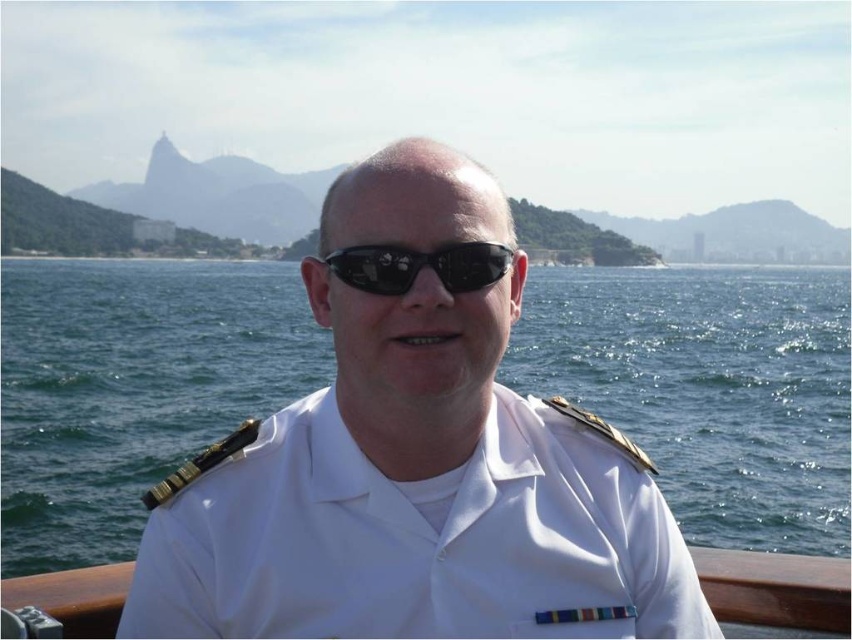
Question: Is white uniform at center bigger than black reflective sunglasses at center?

Choices:
 (A) yes
 (B) no

Answer: (A)

Question: Which of the following is the closest to the observer?

Choices:
 (A) white uniform at center
 (B) black reflective sunglasses at center

Answer: (A)

Question: Is white uniform at center to the left of black reflective sunglasses at center from the viewer's perspective?

Choices:
 (A) no
 (B) yes

Answer: (A)

Question: Is white uniform at center closer to camera compared to black reflective sunglasses at center?

Choices:
 (A) no
 (B) yes

Answer: (B)